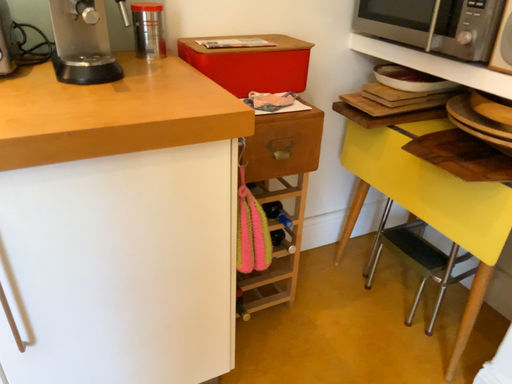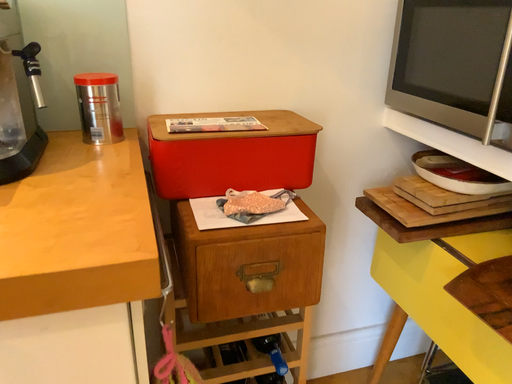
Question: Which way did the camera rotate in the video?

Choices:
 (A) rotated upward
 (B) rotated downward

Answer: (A)